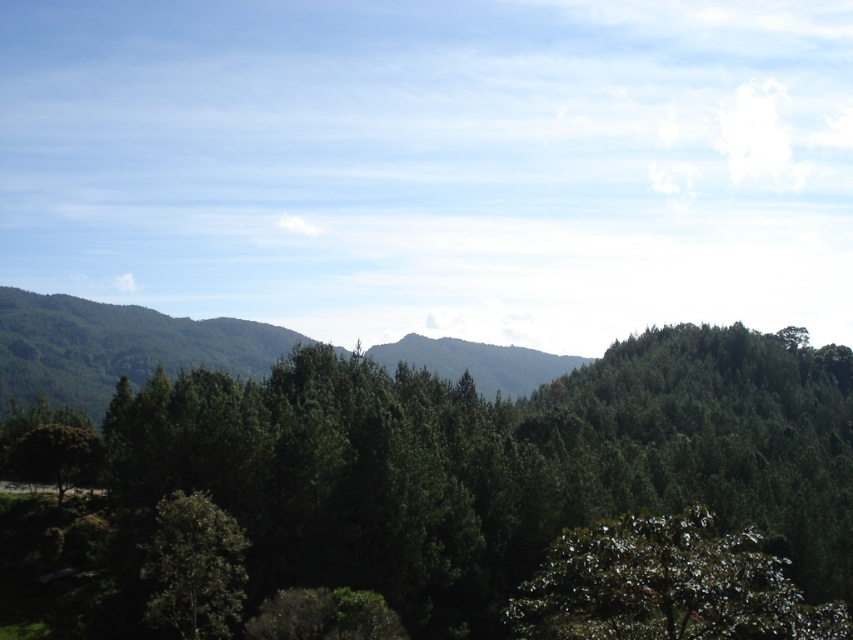
Question: Which object is the closest to the green matte tree at lower left?

Choices:
 (A) green leafy forest at center
 (B) green glossy tree at lower right

Answer: (B)

Question: Is green leafy forest at center above green leafy hillside at left?

Choices:
 (A) yes
 (B) no

Answer: (B)

Question: Which point is closer to the camera?

Choices:
 (A) green matte tree at lower left
 (B) green leafy hillside at left
 (C) green glossy tree at lower right
 (D) green leafy forest at center

Answer: (C)

Question: Which of the following is the farthest from the observer?

Choices:
 (A) green leafy hillside at left
 (B) green glossy tree at lower right
 (C) green matte tree at lower left

Answer: (A)

Question: Observing the image, what is the correct spatial positioning of green leafy forest at center in reference to green matte tree at lower left?

Choices:
 (A) right
 (B) left

Answer: (A)

Question: Can you confirm if green leafy forest at center is thinner than green glossy tree at lower right?

Choices:
 (A) yes
 (B) no

Answer: (B)